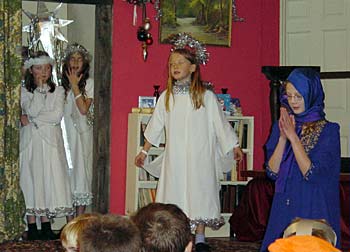
This screenshot has height=252, width=350. What are the coordinates of `red wall` in the screenshot? It's located at (135, 78).